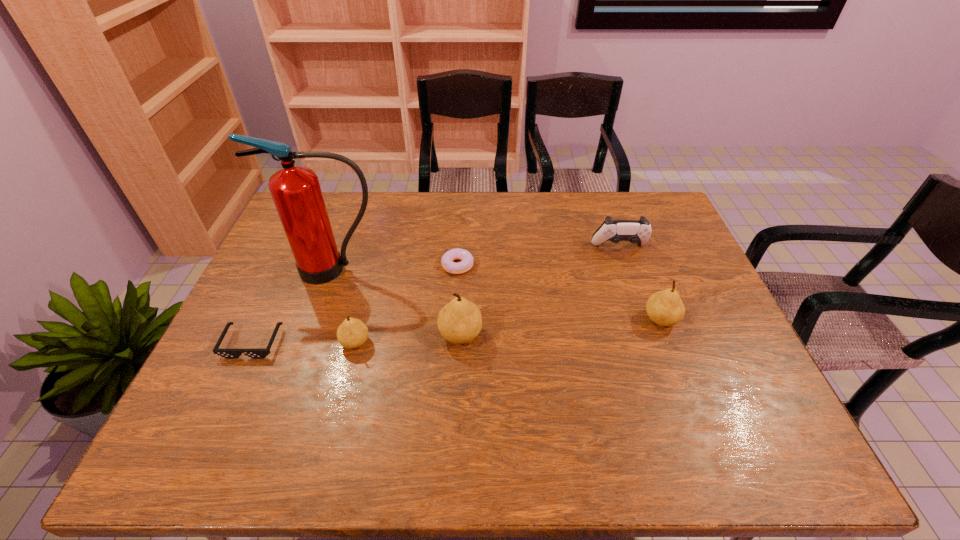
Please point a spot to place another pear for symmetrical spacing. Please provide its 2D coordinates. Your answer should be formatted as a tuple, i.e. [(x, y)], where the tuple contains the x and y coordinates of a point satisfying the conditions above.

[(563, 327)]